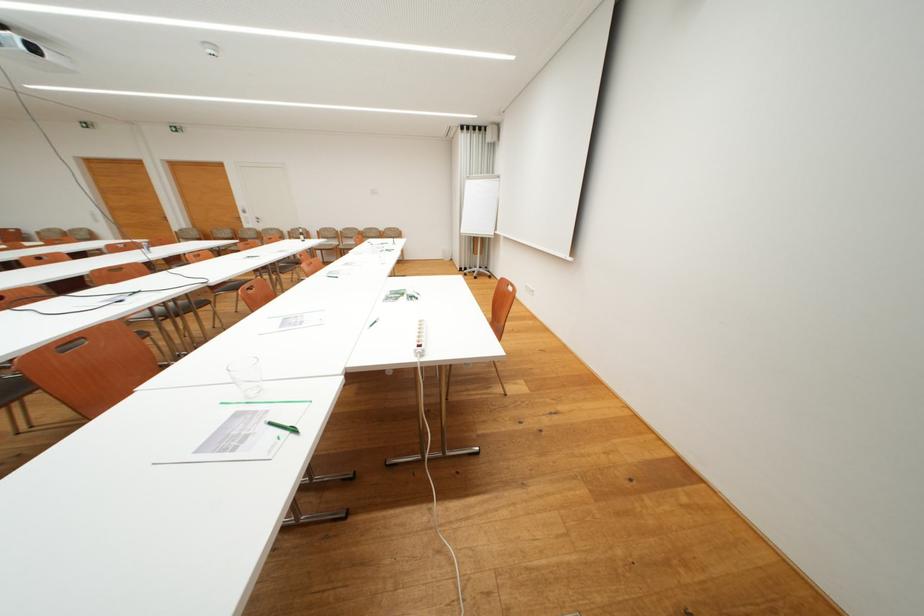
The location [283,427] corresponds to which object?

It refers to a green pen.